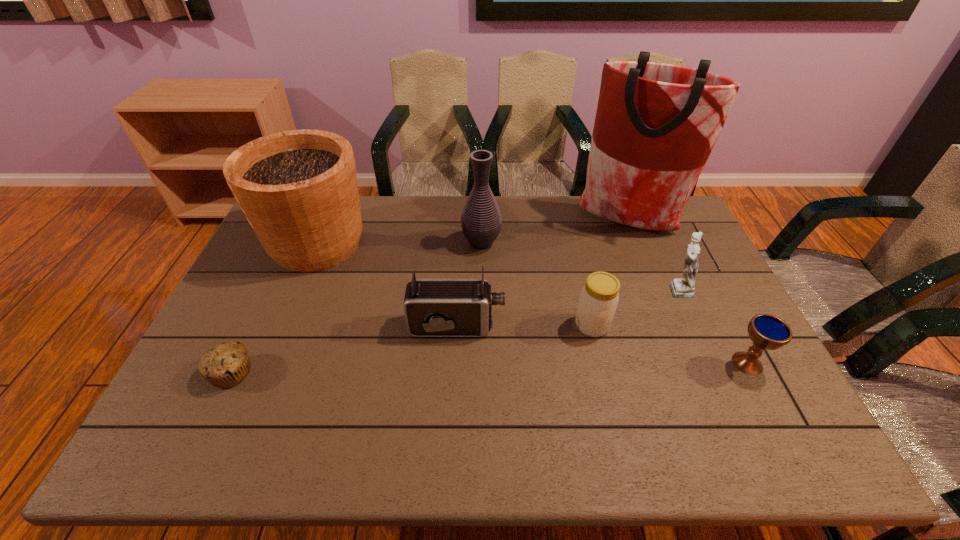
At what (x,y) coordinates should I click in order to perform the action: click on free space located 0.080m on the right of the flowerpot. Please return your answer as a coordinate pair (x, y). Image resolution: width=960 pixels, height=540 pixels. Looking at the image, I should click on (394, 244).

Find the location of a particular element. The height and width of the screenshot is (540, 960). free space located on the front-facing side of the figurine is located at coordinates (567, 289).

Identify the location of vacant region located 0.100m on the front-facing side of the figurine. The height and width of the screenshot is (540, 960). (630, 289).

Identify the location of vacant space located on the front-facing side of the figurine. (646, 289).

Where is `free space located at the lens of the camcorder`? free space located at the lens of the camcorder is located at coordinates (579, 326).

Find the location of a particular element. free space located 0.270m on the back of the jar is located at coordinates (575, 251).

Identify the location of blank area located on the back of the seventh tallest object. (705, 281).

Locate an element on the screen. Image resolution: width=960 pixels, height=540 pixels. free space located on the back of the shortest object is located at coordinates (254, 325).

Where is `grocery bag positioned at the far edge`? The width and height of the screenshot is (960, 540). grocery bag positioned at the far edge is located at coordinates [x=656, y=124].

Where is `vase present at the far edge`? The width and height of the screenshot is (960, 540). vase present at the far edge is located at coordinates (481, 221).